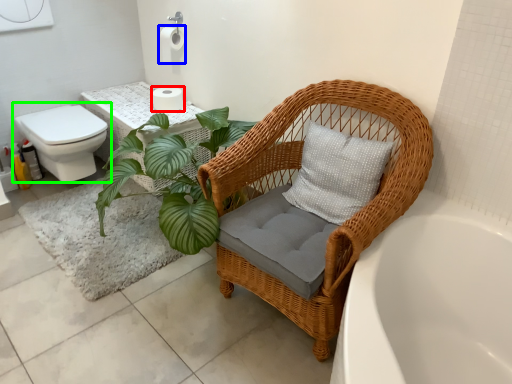
Question: Estimate the real-world distances between objects in this image. Which object is farther from toilet paper (highlighted by a red box), toilet paper (highlighted by a blue box) or toilet (highlighted by a green box)?

Choices:
 (A) toilet paper
 (B) toilet

Answer: (B)